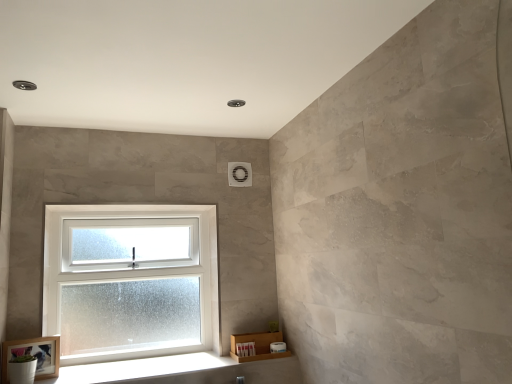
Question: From the image's perspective, is wooden frame at lower left located above or below white frosted glass window at lower left?

Choices:
 (A) above
 (B) below

Answer: (B)

Question: Considering the positions of wooden frame at lower left and white frosted glass window at lower left in the image, is wooden frame at lower left bigger or smaller than white frosted glass window at lower left?

Choices:
 (A) small
 (B) big

Answer: (A)

Question: Estimate the real-world distances between objects in this image. Which object is farther from the white wood at lower left?

Choices:
 (A) wooden frame at lower left
 (B) white frosted glass window at lower left

Answer: (A)

Question: Based on their relative distances, which object is nearer to the white wood at lower left?

Choices:
 (A) white frosted glass window at lower left
 (B) wooden frame at lower left

Answer: (A)